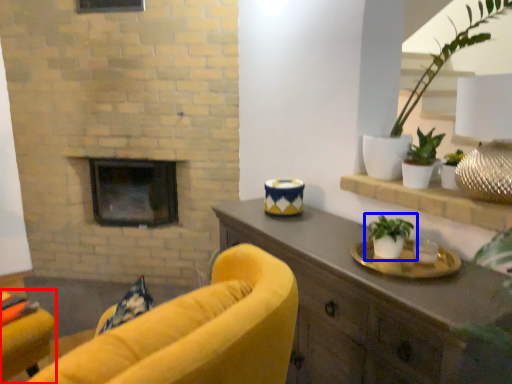
Question: Which object is further to the camera taking this photo, chair (highlighted by a red box) or houseplant (highlighted by a blue box)?

Choices:
 (A) chair
 (B) houseplant

Answer: (A)